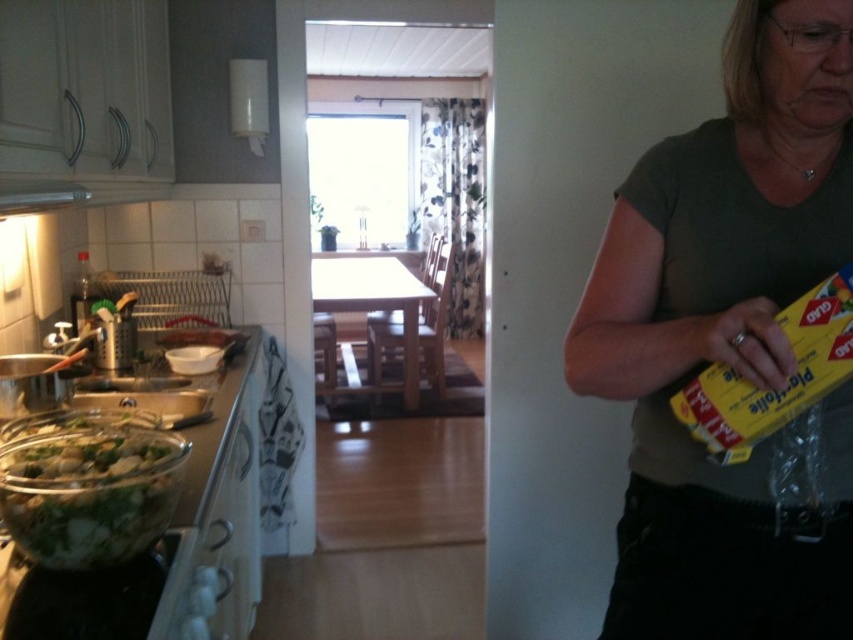
Question: Which object is positioned farthest from the green leafy vegetables at lower left?

Choices:
 (A) gray matte t-shirt at upper right
 (B) metallic silver exhaust hood at upper left

Answer: (A)

Question: Can you confirm if green leafy vegetables at lower left is positioned above metallic silver exhaust hood at upper left?

Choices:
 (A) yes
 (B) no

Answer: (B)

Question: Does gray matte t-shirt at upper right have a larger size compared to green leafy vegetables at lower left?

Choices:
 (A) no
 (B) yes

Answer: (B)

Question: Which point is farther from the camera taking this photo?

Choices:
 (A) (77, 504)
 (B) (770, 113)

Answer: (B)

Question: Can you confirm if gray matte t-shirt at upper right is positioned to the left of green leafy vegetables at lower left?

Choices:
 (A) yes
 (B) no

Answer: (B)

Question: Which point is farther to the camera?

Choices:
 (A) (28, 184)
 (B) (723, 316)

Answer: (A)